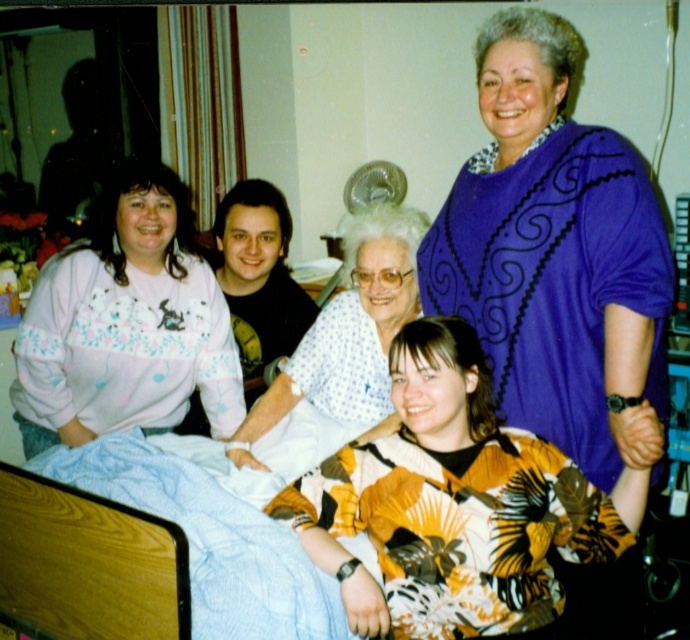
You are a nurse preparing to take measurements for a patient in the room. You notice the matte pink sweater at left and the white dotted fabric at center. Which item has a greater width according to the description?

The matte pink sweater at left has a greater width than the white dotted fabric at center as stated in the description.

You are a nurse in a hospital room where the patient is seated on the bed. You need to place a medical chart on the purple swirled sweater at upper right located at point (x=555, y=257). Is the purple swirled sweater at upper right a suitable surface for placing the medical chart?

The purple swirled sweater at upper right is located at point (x=555, y=257), so yes, the medical chart can be placed there as the coordinates match the sweater.

You are a photographer who needs to take a picture of the purple swirled sweater at upper right. The camera is placed where? Please state the distance between them in feet.

The purple swirled sweater at upper right and the camera are 4.70 feet apart from each other, so the camera is placed 4.70 feet away from the purple swirled sweater at upper right.